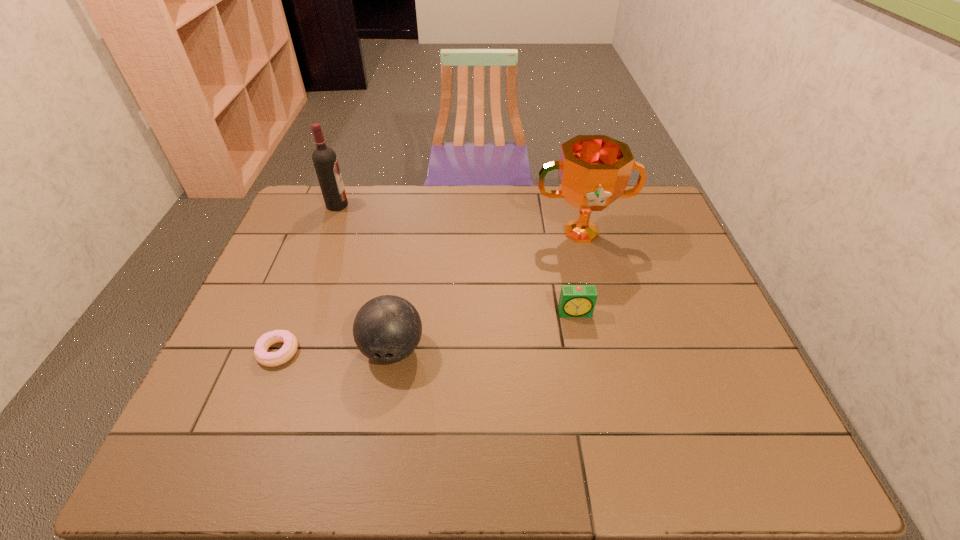
The width and height of the screenshot is (960, 540). Identify the location of the farthest object. (325, 161).

I want to click on award, so click(593, 170).

Locate an element on the screen. The width and height of the screenshot is (960, 540). the third shortest object is located at coordinates (387, 329).

What are the coordinates of `bowling ball` in the screenshot? It's located at (387, 329).

Locate an element on the screen. The width and height of the screenshot is (960, 540). the third nearest object is located at coordinates (575, 300).

Locate an element on the screen. the second shortest object is located at coordinates (575, 300).

Identify the location of the shortest object. (269, 359).

This screenshot has height=540, width=960. In order to click on vacant point located 0.100m on the label of the wine bottle in this screenshot , I will do (376, 205).

Where is `vacant area situated 0.380m on the side of the fourth nearest object with the star emblem`? vacant area situated 0.380m on the side of the fourth nearest object with the star emblem is located at coordinates (612, 355).

Image resolution: width=960 pixels, height=540 pixels. I want to click on free space located 0.170m on the grip area of the third tallest object, so click(376, 447).